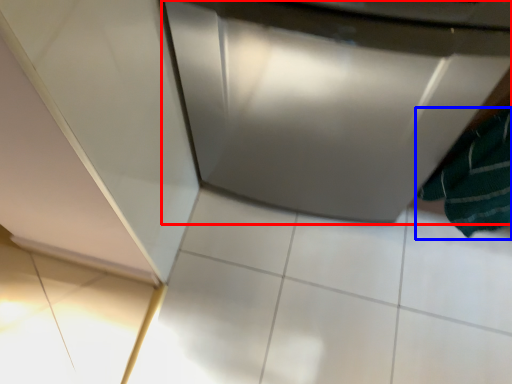
Question: Which of the following is the farthest to the observer, home appliance (highlighted by a red box) or bath towel (highlighted by a blue box)?

Choices:
 (A) home appliance
 (B) bath towel

Answer: (A)